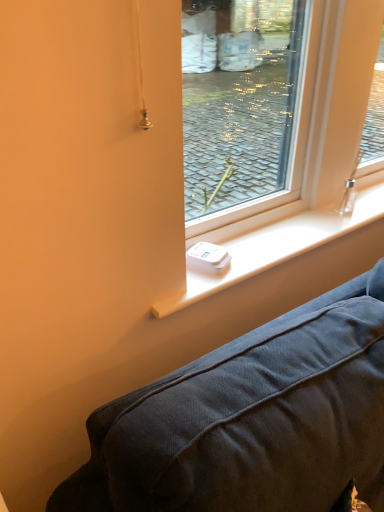
Locate an element on the screen. This screenshot has width=384, height=512. free point above white plastic device at center (from a real-world perspective) is located at coordinates (283, 239).